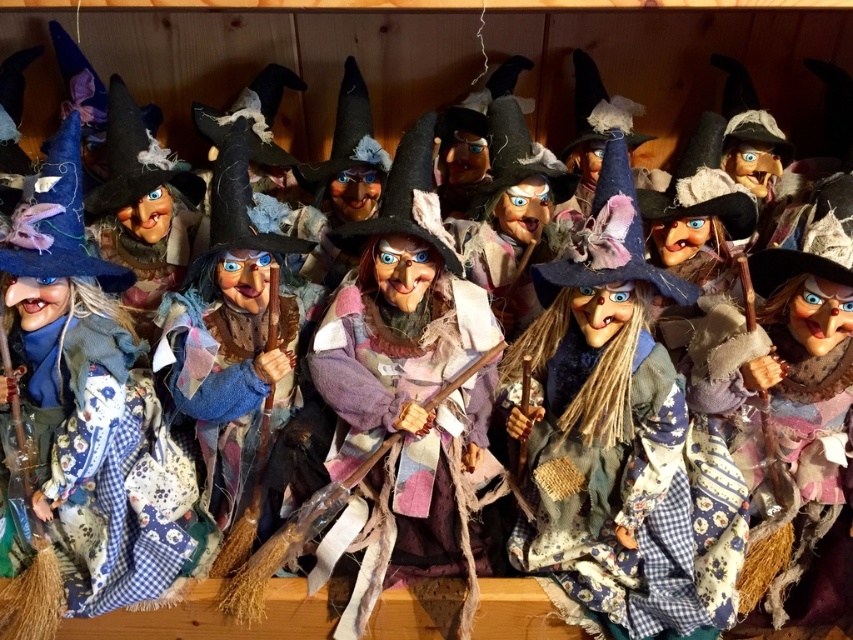
You are a collector of witch dolls and want to place a new doll between the two existing ones on the shelf. The new doll is 0.3 meters wide. Is there enough space between the matte blue fabric witch at left and the other doll to fit it?

The space between the matte blue fabric witch at left and the other doll is 1.24 meters, which is wider than the new doll of 0.3 meters. Therefore, there is enough space to fit the new doll between them.

You are an interior designer planning to place a new decorative item on the shelf where the patchwork fabric witch at center and the matte blue fabric witch at left are located. The new item requires a space wider than the wider of the two witches. What is the minimum width you should consider for the new item?

The patchwork fabric witch at center is wider than the matte blue fabric witch at left. Therefore, the minimum width required for the new item should be greater than the width of the patchwork fabric witch at center.

You are a delivery person who needs to place a new witch doll that is 12 inches wide between the patchwork fabric witch at center and the matte blue fabric witch at left. Can you fit it there?

The distance between the patchwork fabric witch at center and the matte blue fabric witch at left is 26.90 inches. Since the new witch doll is only 12 inches wide, there is enough space to place it between them.